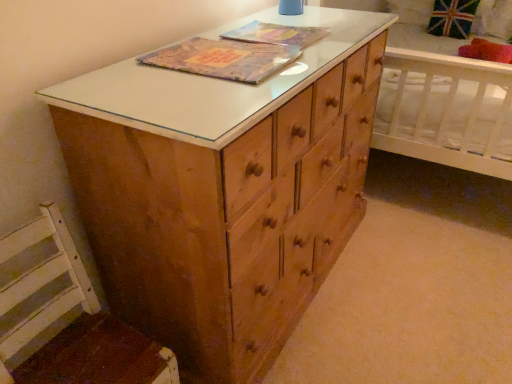
Question: Would you say red plush pillow at upper right is to the left or to the right of wooden swivel chair at lower left in the picture?

Choices:
 (A) right
 (B) left

Answer: (A)

Question: Is red plush pillow at upper right inside or outside of wooden swivel chair at lower left?

Choices:
 (A) outside
 (B) inside

Answer: (A)

Question: Which is nearer to the textured paper book at center, which appears as the first book cover when viewed from the front?

Choices:
 (A) wooden swivel chair at lower left
 (B) red plush pillow at upper right
 (C) matte plastic book at center, the 2th book cover when ordered from front to back

Answer: (C)

Question: Considering the real-world distances, which object is farthest from the textured paper book at center, the second book cover in the back-to-front sequence?

Choices:
 (A) matte plastic book at center, which appears as the 1th book cover when viewed from the back
 (B) wooden swivel chair at lower left
 (C) red plush pillow at upper right

Answer: (C)